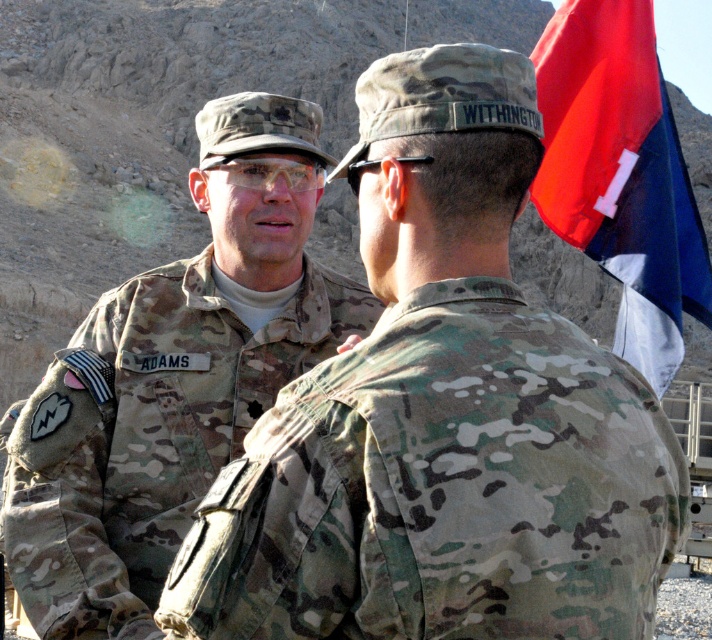
Question: Among these objects, which one is nearest to the camera?

Choices:
 (A) camouflage uniform at left
 (B) red fabric flag at upper right
 (C) camouflage fabric uniform at left

Answer: (A)

Question: Does camouflage uniform at left come in front of red fabric flag at upper right?

Choices:
 (A) no
 (B) yes

Answer: (B)

Question: Does camouflage uniform at left have a greater width compared to camouflage fabric uniform at left?

Choices:
 (A) yes
 (B) no

Answer: (A)

Question: Among these points, which one is farthest from the camera?

Choices:
 (A) (585, 202)
 (B) (117, 428)

Answer: (A)

Question: Which point appears closest to the camera in this image?

Choices:
 (A) (150, 547)
 (B) (654, 250)
 (C) (382, 250)

Answer: (C)

Question: From the image, what is the correct spatial relationship of camouflage uniform at left in relation to red fabric flag at upper right?

Choices:
 (A) left
 (B) right

Answer: (A)